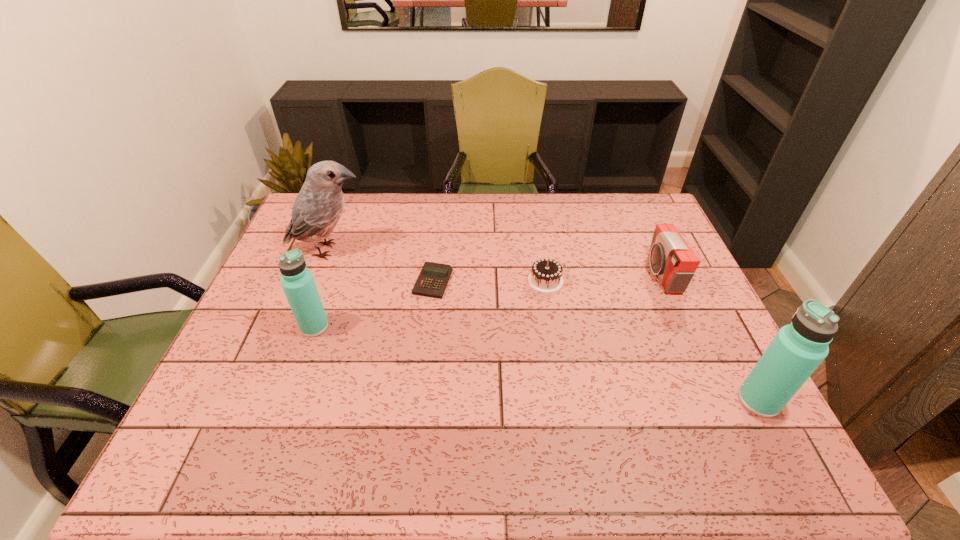
The width and height of the screenshot is (960, 540). In order to click on blank area in the image that satisfies the following two spatial constraints: 1. on the front-facing side of the second object from right to left; 2. on the left side of the nearer thermos bottle in this screenshot , I will do `click(717, 401)`.

You are a GUI agent. You are given a task and a screenshot of the screen. Output one action in this format:
    pyautogui.click(x=<x>, y=<y>)
    Task: Click on the blank area in the image that satisfies the following two spatial constraints: 1. on the front-facing side of the right thermos bottle; 2. on the left side of the parrot
    
    Given the screenshot: What is the action you would take?
    pyautogui.click(x=270, y=401)

Locate an element on the screen. Image resolution: width=960 pixels, height=540 pixels. free space that satisfies the following two spatial constraints: 1. on the back side of the third object from right to left; 2. on the front-facing side of the parrot is located at coordinates (x=540, y=250).

Identify the location of vacant space that satisfies the following two spatial constraints: 1. on the front-facing side of the camera; 2. on the front side of the calculator. This screenshot has height=540, width=960. click(664, 281).

Find the location of a particular element. Image resolution: width=960 pixels, height=540 pixels. vacant space that satisfies the following two spatial constraints: 1. on the front-facing side of the rightmost object; 2. on the right side of the third shortest object is located at coordinates (717, 401).

Where is `free space that satisfies the following two spatial constraints: 1. on the front-facing side of the parrot; 2. on the left side of the farther thermos bottle`? Image resolution: width=960 pixels, height=540 pixels. free space that satisfies the following two spatial constraints: 1. on the front-facing side of the parrot; 2. on the left side of the farther thermos bottle is located at coordinates (299, 327).

Where is `vacant position in the image that satisfies the following two spatial constraints: 1. on the front-facing side of the parrot; 2. on the back side of the chocolate cake`? The height and width of the screenshot is (540, 960). vacant position in the image that satisfies the following two spatial constraints: 1. on the front-facing side of the parrot; 2. on the back side of the chocolate cake is located at coordinates (317, 280).

The image size is (960, 540). I want to click on vacant space that satisfies the following two spatial constraints: 1. on the front-facing side of the fifth farthest object; 2. on the left side of the parrot, so click(299, 327).